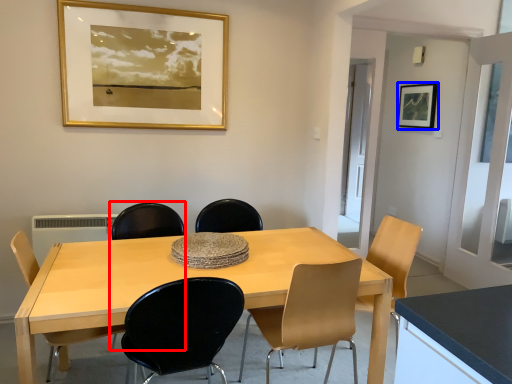
Question: Among these objects, which one is nearest to the camera, armchair (highlighted by a red box) or picture frame (highlighted by a blue box)?

Choices:
 (A) armchair
 (B) picture frame

Answer: (A)